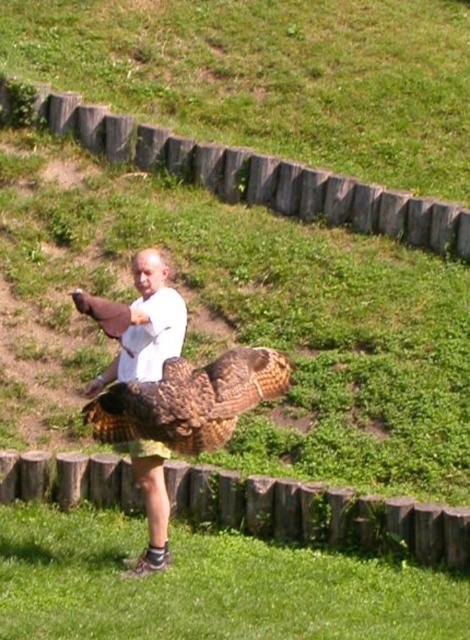
Question: Can you confirm if brown feathered eagle at center is positioned below white matte shirt at center?

Choices:
 (A) yes
 (B) no

Answer: (A)

Question: Is brown feathered eagle at center positioned before white matte shirt at center?

Choices:
 (A) no
 (B) yes

Answer: (A)

Question: Which of the following is the closest to the observer?

Choices:
 (A) white matte shirt at center
 (B) brown feathered eagle at center

Answer: (A)

Question: Does brown feathered eagle at center appear over white matte shirt at center?

Choices:
 (A) yes
 (B) no

Answer: (B)